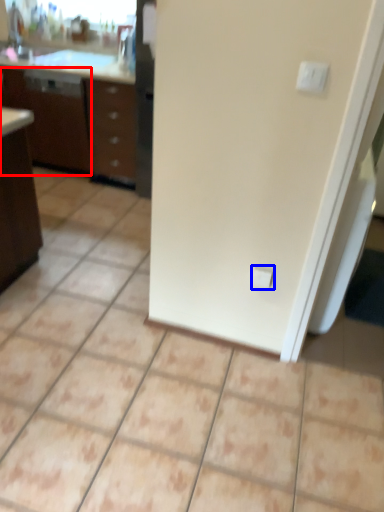
Question: Which point is further to the camera, file cabinet (highlighted by a red box) or electric outlet (highlighted by a blue box)?

Choices:
 (A) file cabinet
 (B) electric outlet

Answer: (A)